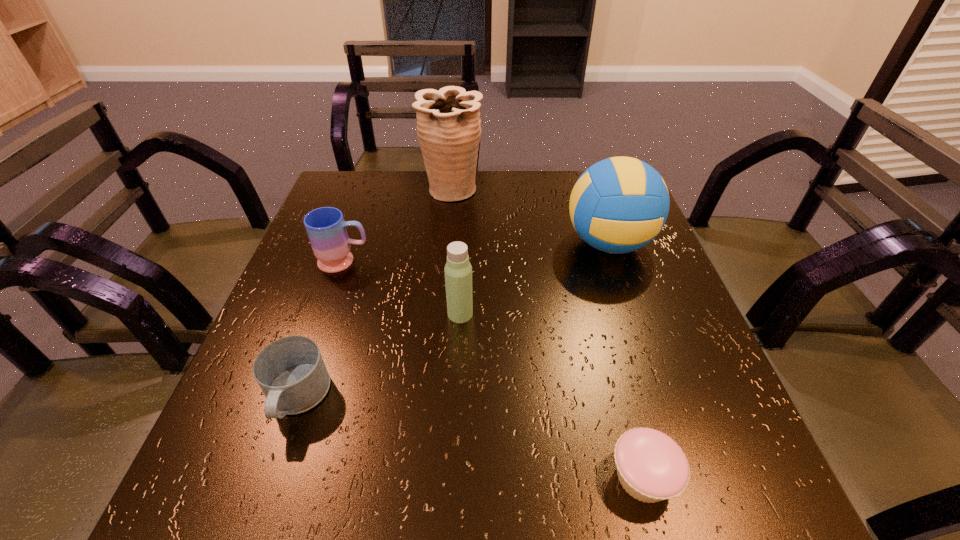
The image size is (960, 540). I want to click on vacant area between the farther mug and the fourth farthest object, so click(x=402, y=288).

Find the location of a particular element. This screenshot has height=540, width=960. free spot between the third shortest object and the nearest object is located at coordinates (493, 369).

Locate an element on the screen. free area in between the farthest object and the fifth shortest object is located at coordinates (531, 216).

Identify the location of free space between the third tallest object and the fifth shortest object. This screenshot has height=540, width=960. (535, 279).

In order to click on free space that is in between the cupcake and the volleyball in this screenshot , I will do `click(626, 360)`.

Identify the location of vacant space that's between the volleyball and the nearest object. The width and height of the screenshot is (960, 540). (626, 360).

The width and height of the screenshot is (960, 540). Identify the location of empty space between the volleyball and the thermos bottle. (535, 279).

At what (x,y) coordinates should I click in order to perform the action: click on free space between the cupcake and the taller mug. Please return your answer as a coordinate pair (x, y). Looking at the image, I should click on (493, 369).

Locate an element on the screen. free space between the shortest object and the thermos bottle is located at coordinates (552, 395).

Choose which object is the fifth nearest neighbor to the third nearest object. Please provide its 2D coordinates. Your answer should be formatted as a tuple, i.e. [(x, y)], where the tuple contains the x and y coordinates of a point satisfying the conditions above.

[(448, 121)]